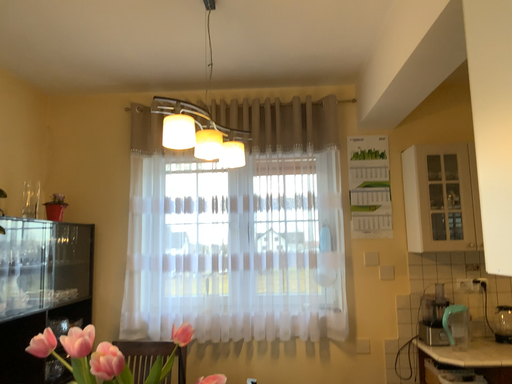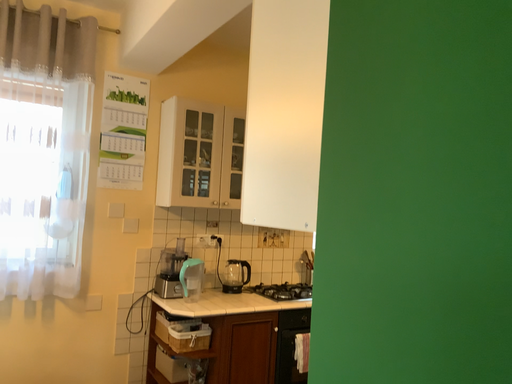
Question: Which way did the camera rotate in the video?

Choices:
 (A) rotated right
 (B) rotated left

Answer: (A)